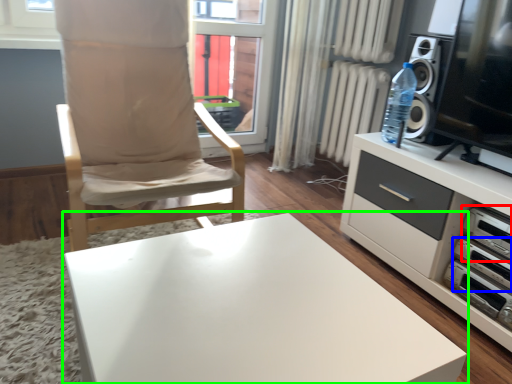
Question: Based on their relative distances, which object is farther from appliance (highlighted by a red box)? Choose from appliance (highlighted by a blue box) and table (highlighted by a green box).

Choices:
 (A) appliance
 (B) table

Answer: (B)